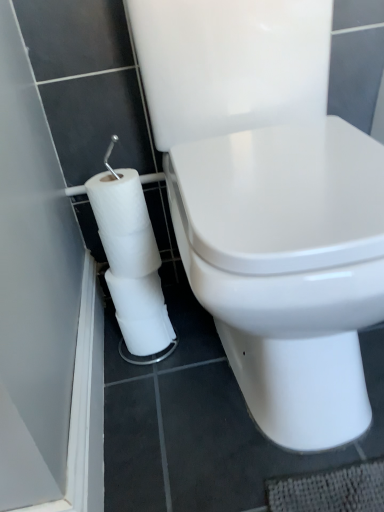
Question: Does point pyautogui.click(x=286, y=437) appear closer or farther from the camera than point pyautogui.click(x=132, y=271)?

Choices:
 (A) farther
 (B) closer

Answer: (B)

Question: From a real-world perspective, is white glossy toilet at center physically located above or below white matte toilet paper at lower left?

Choices:
 (A) below
 (B) above

Answer: (B)

Question: Is white glossy toilet at center in front of or behind white matte toilet paper at lower left in the image?

Choices:
 (A) behind
 (B) front

Answer: (B)

Question: Looking at their shapes, would you say white matte toilet paper at lower left is wider or thinner than white glossy toilet at center?

Choices:
 (A) thin
 (B) wide

Answer: (A)

Question: Relative to white glossy toilet at center, is white matte toilet paper at lower left in front or behind?

Choices:
 (A) front
 (B) behind

Answer: (B)

Question: Considering the positions of white matte toilet paper at lower left and white glossy toilet at center in the image, is white matte toilet paper at lower left bigger or smaller than white glossy toilet at center?

Choices:
 (A) small
 (B) big

Answer: (A)

Question: From a real-world perspective, is white matte toilet paper at lower left physically located above or below white glossy toilet at center?

Choices:
 (A) below
 (B) above

Answer: (A)